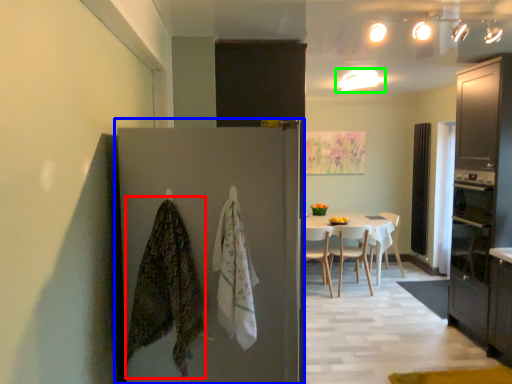
Question: Based on their relative distances, which object is nearer to blanket (highlighted by a red box)? Choose from door (highlighted by a blue box) and lighting (highlighted by a green box).

Choices:
 (A) door
 (B) lighting

Answer: (A)